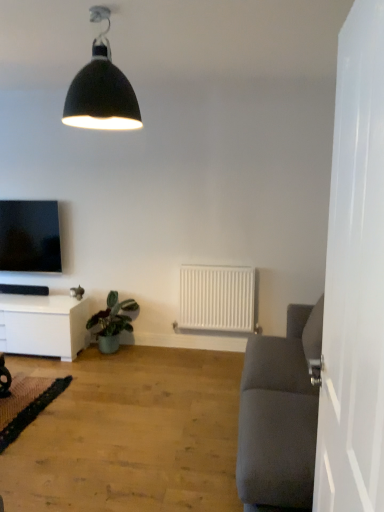
Where is `vacant area that is in front of green matte plant at lower left`? vacant area that is in front of green matte plant at lower left is located at coordinates (98, 370).